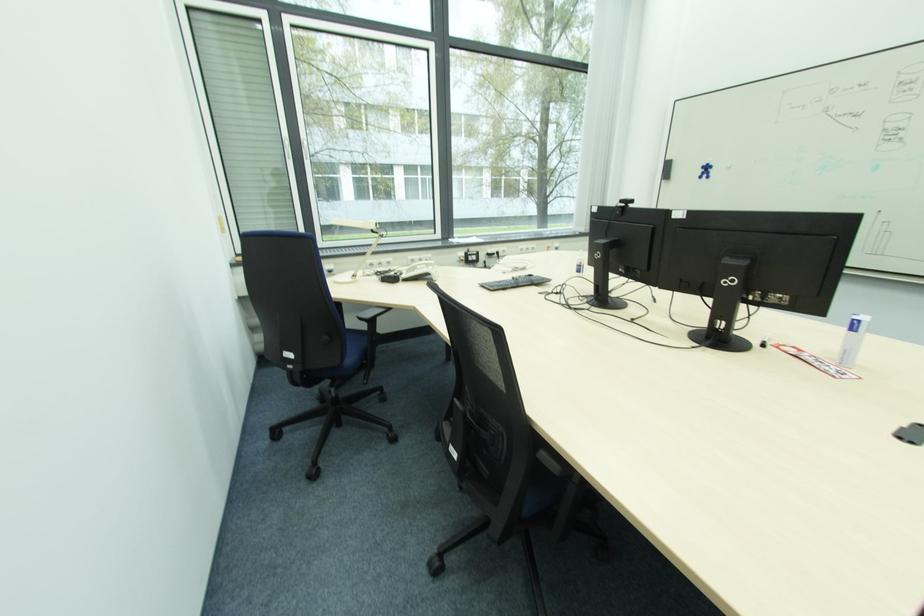
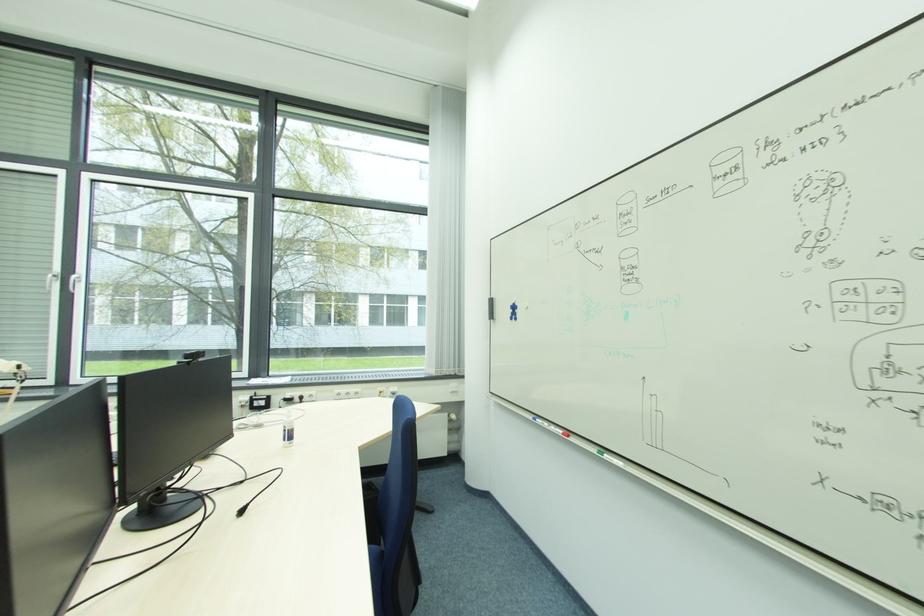
Question: In a continuous first-person perspective shot, in which direction is the camera moving?

Choices:
 (A) Left
 (B) Right
 (C) Forward
 (D) Backward

Answer: (B)